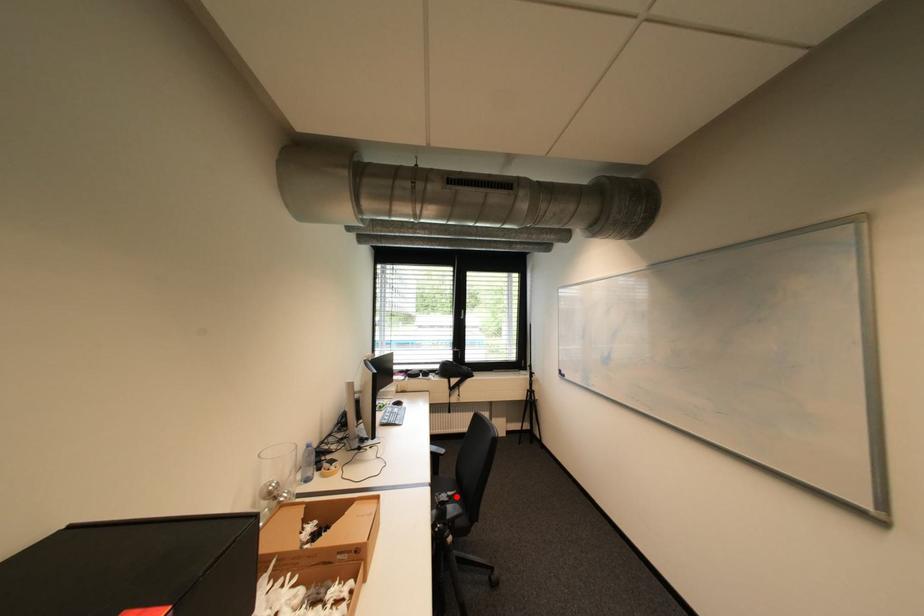
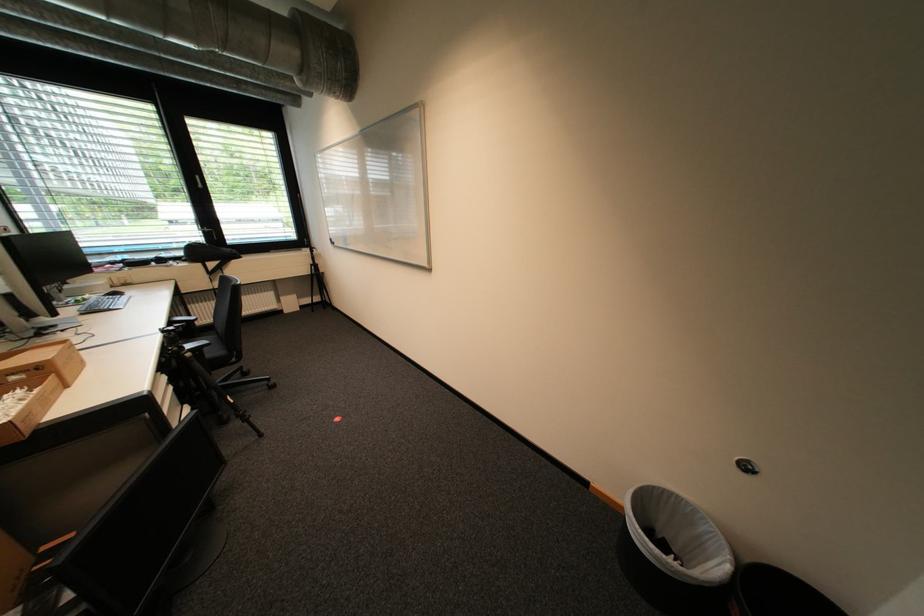
The point at the highlighted location is marked in the first image. Where is the corresponding point in the second image?

(184, 328)